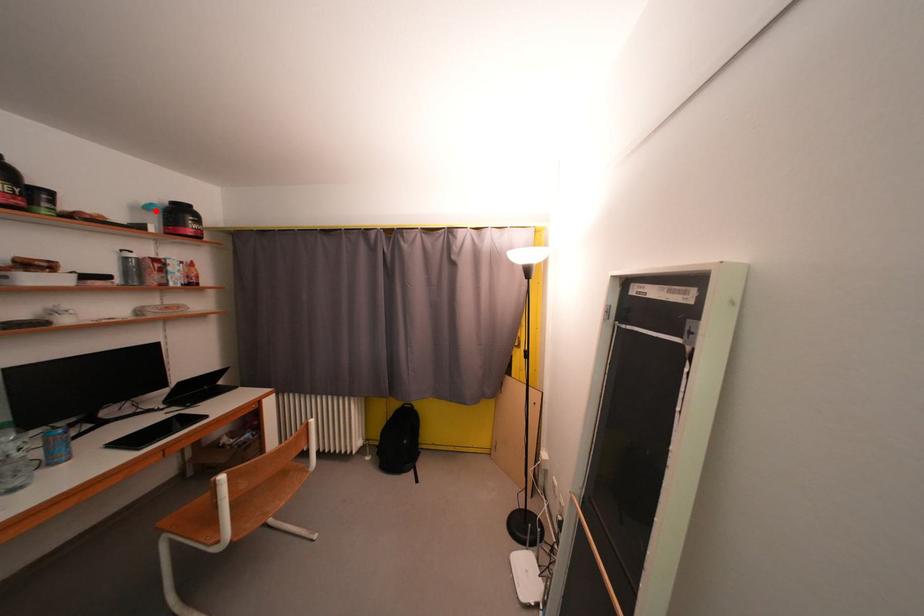
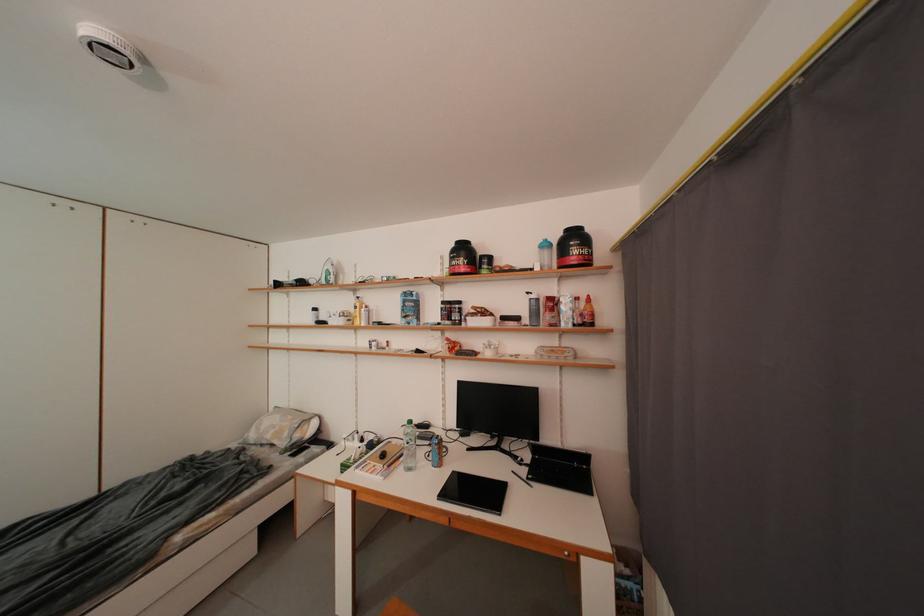
In the second image, find the point that corresponds to the highlighted location in the first image.

(553, 249)